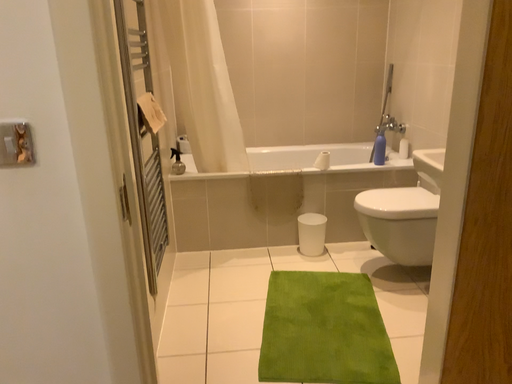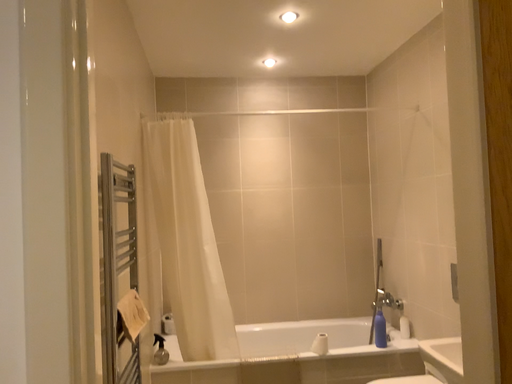
Question: How did the camera likely rotate when shooting the video?

Choices:
 (A) rotated upward
 (B) rotated downward

Answer: (A)